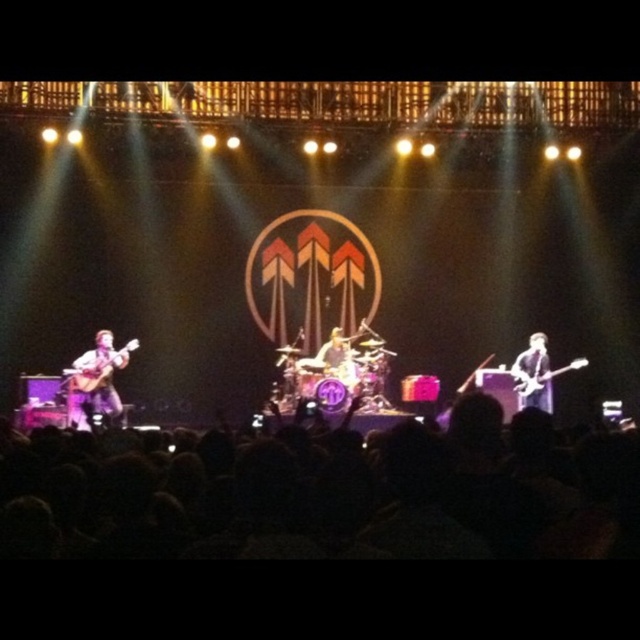
Question: Which object is positioned farthest from the black fabric crowd at lower center?

Choices:
 (A) shiny silver guitar at center
 (B) glossy black guitar at right
 (C) matte brown guitar at left
 (D) glossy electric guitar at right

Answer: (D)

Question: Among these objects, which one is nearest to the camera?

Choices:
 (A) glossy electric guitar at right
 (B) glossy black guitar at right
 (C) black fabric crowd at lower center

Answer: (C)

Question: Can you confirm if glossy black guitar at right is thinner than glossy electric guitar at right?

Choices:
 (A) no
 (B) yes

Answer: (B)

Question: Among these points, which one is nearest to the camera?

Choices:
 (A) (72, 388)
 (B) (340, 330)
 (C) (518, 387)

Answer: (A)

Question: Does matte brown guitar at left appear on the left side of shiny silver guitar at center?

Choices:
 (A) yes
 (B) no

Answer: (A)

Question: Can you confirm if glossy black guitar at right is thinner than shiny silver guitar at center?

Choices:
 (A) no
 (B) yes

Answer: (A)